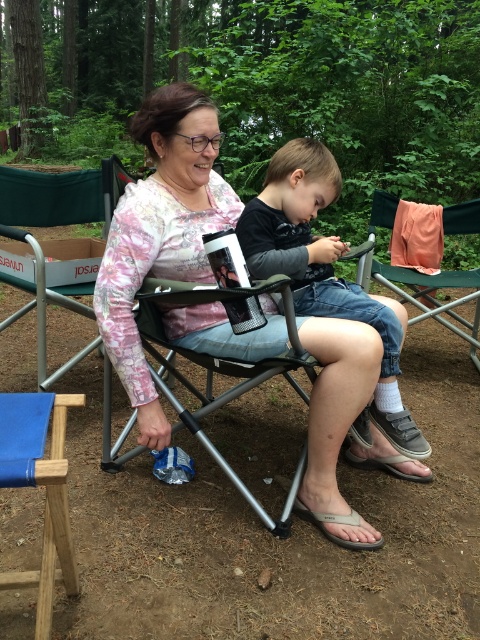
Question: Does pink floral shirt at center appear over green fabric chair at center?

Choices:
 (A) yes
 (B) no

Answer: (B)

Question: Considering the real-world distances, which object is farthest from the green fabric chair at center?

Choices:
 (A) pink floral shirt at center
 (B) blue fabric folding chair at lower left
 (C) metallic silver chair at center
 (D) dark gray fabric toddler at center

Answer: (B)

Question: In this image, where is pink floral shirt at center located relative to metallic silver chair at center?

Choices:
 (A) below
 (B) above

Answer: (B)

Question: Which point is closer to the camera?

Choices:
 (A) (441, 276)
 (B) (6, 394)

Answer: (B)

Question: Which point is closer to the camera?

Choices:
 (A) (313, 285)
 (B) (267, 364)
 (C) (52, 435)
 (D) (384, 224)

Answer: (C)

Question: In this image, where is dark gray fabric toddler at center located relative to metallic silver chair at center?

Choices:
 (A) above
 (B) below

Answer: (A)